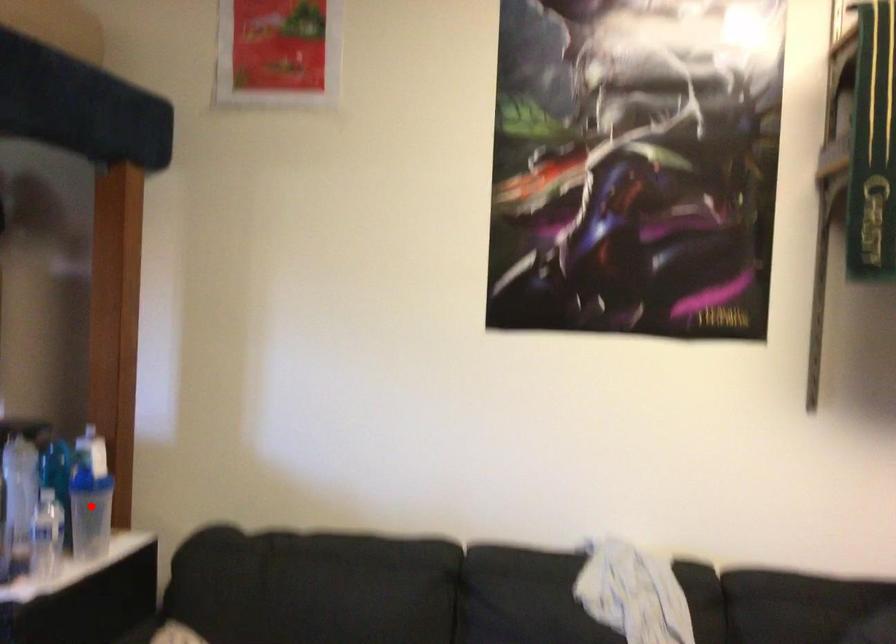
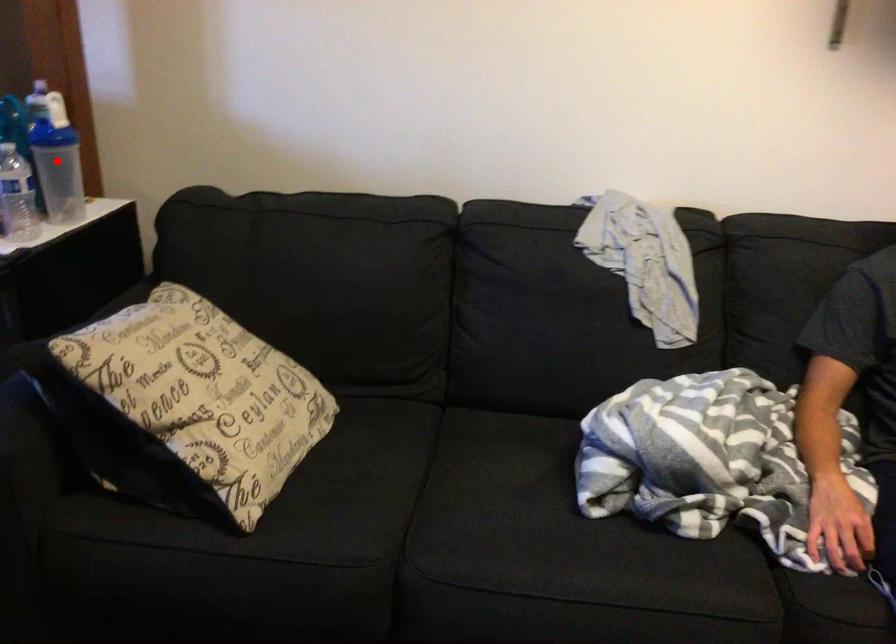
I am providing you with two images of the same scene from different viewpoints. A red point is marked on the first image and another point is marked on the second image. Is the red point in image1 aligned with the point shown in image2?

Yes